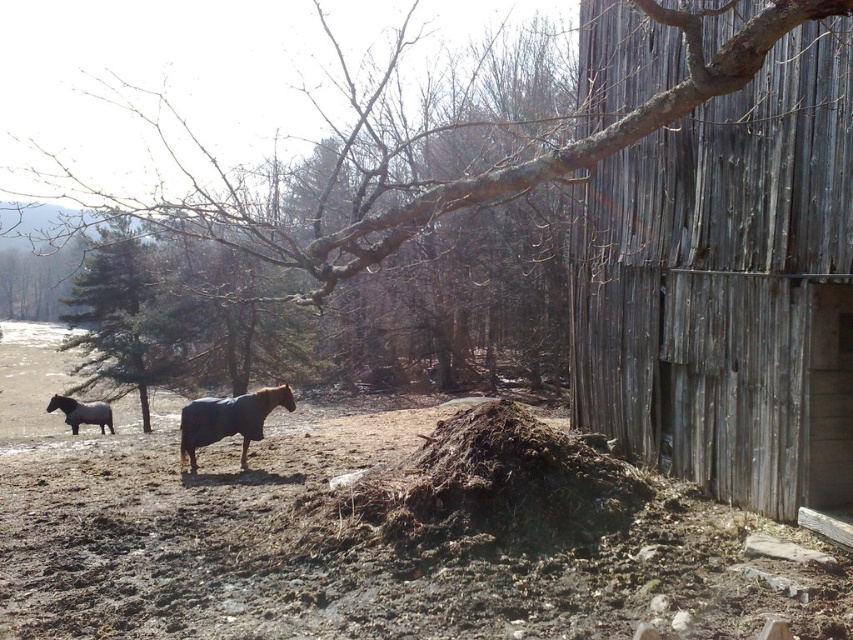
You are a farmer checking the field. You see the weathered wood barn at right and the brown glossy horse at center. Which object is positioned higher in the image?

The weathered wood barn at right is located above the brown glossy horse at center, so it is positioned higher in the image.

You are standing at the point with coordinates point (245,460) and want to walk towards the barn. There is an obstacle at point (730,480). Will the obstacle block your path to the barn?

Point (730,480) is in front of point (245,460), so the obstacle at point (730,480) will block your path to the barn.

You are a farmer planning to plant a new row of crops between the brown bark tree at center and the green textured pine tree at left. The row requires a minimum of 50 feet of space. Based on the scene, will there be enough space for the crops?

The distance between the brown bark tree at center and the green textured pine tree at left is 43.74 feet, which is less than the required 50 feet. Therefore, there is insufficient space to plant the new row of crops.